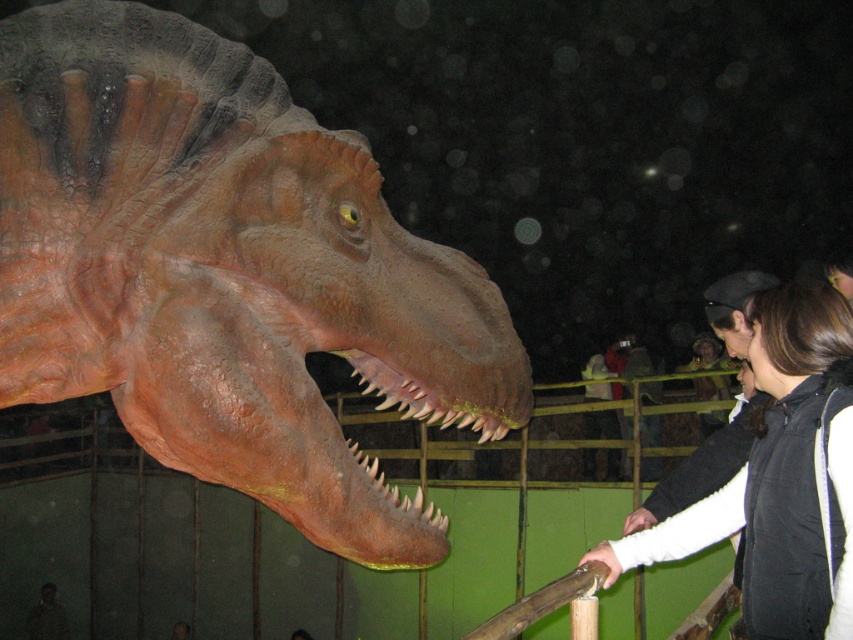
Between matte orange dinosaur head at center and dark brown hair at upper right, which one has less height?

Standing shorter between the two is dark brown hair at upper right.

Which of these two, matte orange dinosaur head at center or dark brown hair at upper right, stands taller?

Standing taller between the two is matte orange dinosaur head at center.

Is point (216, 305) positioned after point (827, 304)?

That is False.

You are a GUI agent. You are given a task and a screenshot of the screen. Output one action in this format:
    pyautogui.click(x=<x>, y=<y>)
    Task: Click on the matte orange dinosaur head at center
    
    Given the screenshot: What is the action you would take?
    pyautogui.click(x=225, y=273)